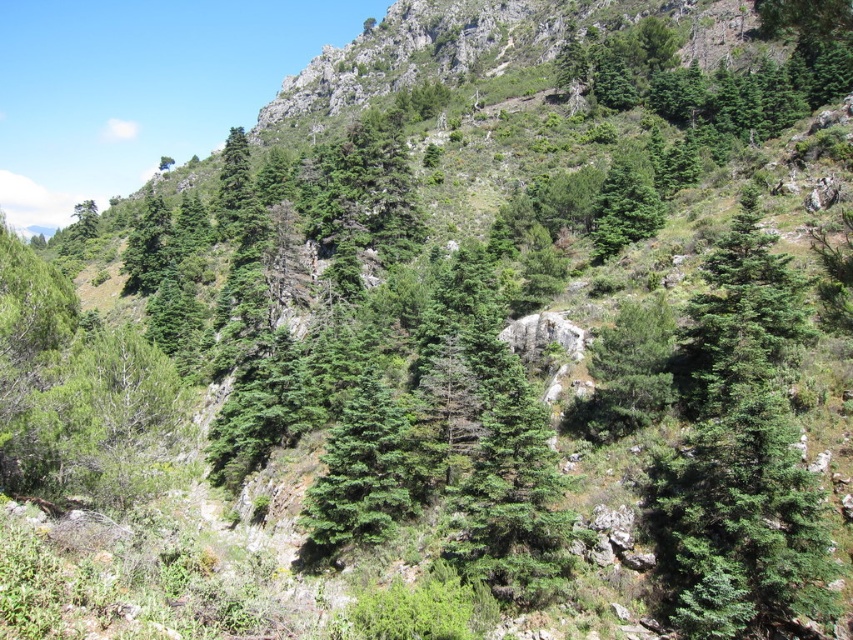
Which is below, green matte tree at center-right or green matte tree at upper center?

green matte tree at center-right is lower down.

This screenshot has height=640, width=853. Find the location of `green matte tree at center-right`. green matte tree at center-right is located at coordinates (737, 454).

Identify the location of green matte tree at center-right. The width and height of the screenshot is (853, 640). (737, 454).